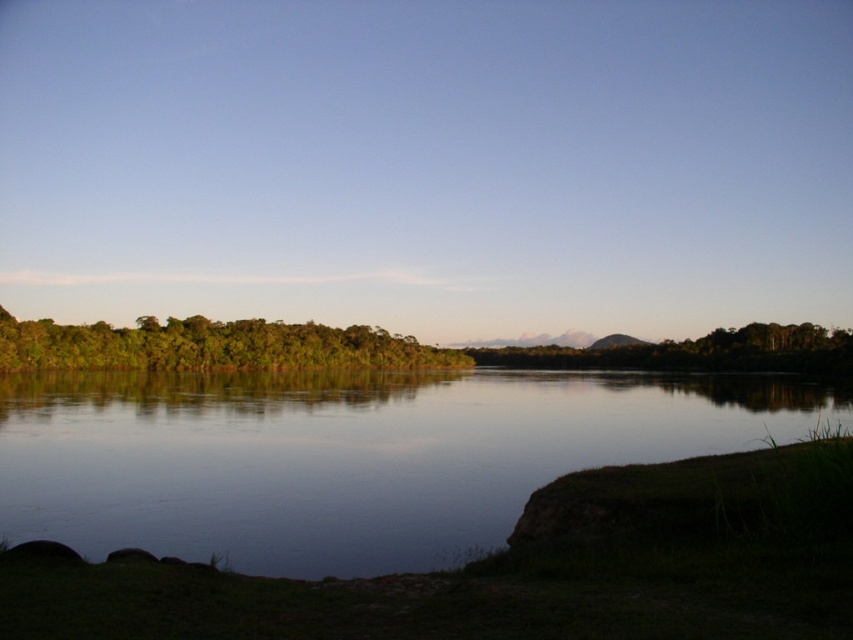
You are standing on the grassy bank and want to take a photo of the smooth water at center and the green leafy trees at left. Which object will appear larger in the photo?

The smooth water at center will appear larger in the photo because it is closer to the viewer than the green leafy trees at left.

You are planning to take a photo of the landscape. You want to ensure that both the smooth water at center and the green leafy trees at left are clearly visible in the frame. Considering their sizes in the image, which object should you focus on to ensure both are in focus?

The green leafy trees at left occupy more space in the image than the smooth water at center. To ensure both are in focus, you should focus on the green leafy trees at left since they are larger and require more detailed capture.

You are standing at the edge of the water in the serene landscape. You see two points marked in the image. Which point is nearer to you, point at coordinates [157,483] or point at coordinates [30,333]?

Point at coordinates [157,483] is closer to the camera than point at coordinates [30,333], so it is nearer to you.